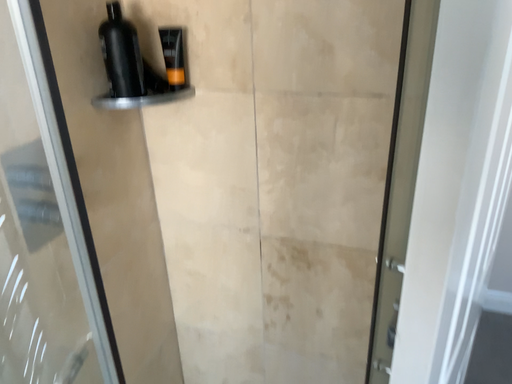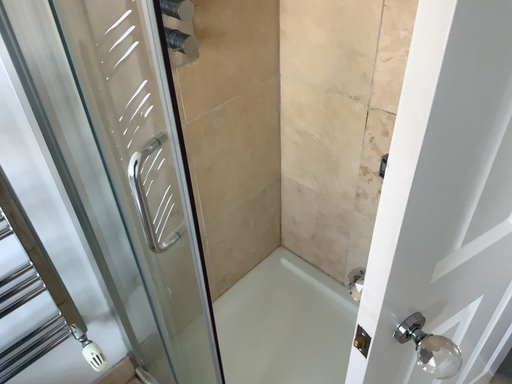
Question: How did the camera likely rotate when shooting the video?

Choices:
 (A) rotated downward
 (B) rotated upward

Answer: (A)